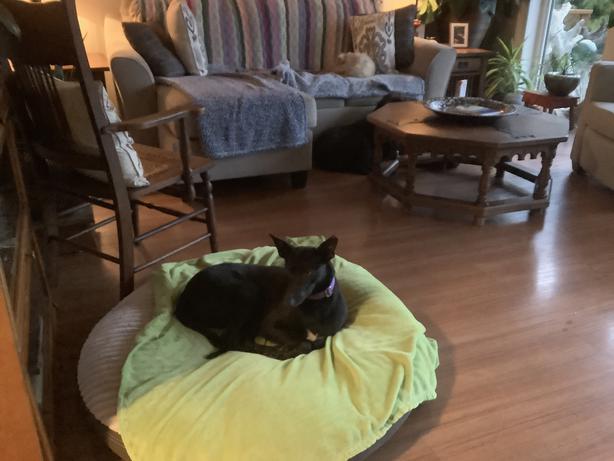
The height and width of the screenshot is (461, 614). What are the coordinates of `table` in the screenshot? It's located at (428, 141).